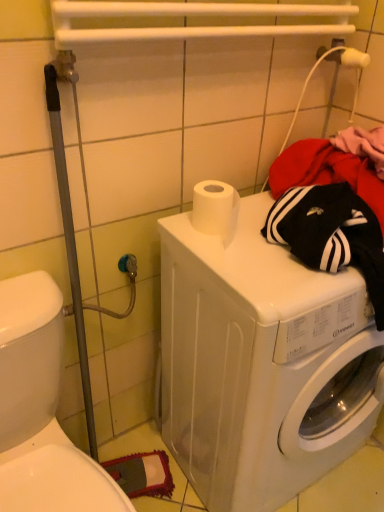
Question: Is white plastic washer at lower right far away from white glossy washing machine at center?

Choices:
 (A) yes
 (B) no

Answer: (B)

Question: Is the position of white plastic washer at lower right less distant than that of white glossy washing machine at center?

Choices:
 (A) no
 (B) yes

Answer: (B)

Question: Does white plastic washer at lower right have a lesser width compared to white glossy washing machine at center?

Choices:
 (A) yes
 (B) no

Answer: (B)

Question: Is white plastic washer at lower right positioned with its back to white glossy washing machine at center?

Choices:
 (A) no
 (B) yes

Answer: (A)

Question: Is white plastic washer at lower right at the right side of white glossy washing machine at center?

Choices:
 (A) no
 (B) yes

Answer: (A)

Question: From the image's perspective, does white plastic washer at lower right appear lower than white glossy washing machine at center?

Choices:
 (A) no
 (B) yes

Answer: (B)

Question: From a real-world perspective, is white glossy washing machine at center on white plastic washer at lower right?

Choices:
 (A) no
 (B) yes

Answer: (B)

Question: Is white glossy washing machine at center closer to camera compared to white plastic washer at lower right?

Choices:
 (A) yes
 (B) no

Answer: (B)

Question: Considering the relative sizes of white glossy washing machine at center and white plastic washer at lower right in the image provided, is white glossy washing machine at center bigger than white plastic washer at lower right?

Choices:
 (A) yes
 (B) no

Answer: (A)

Question: Is white glossy washing machine at center shorter than white plastic washer at lower right?

Choices:
 (A) no
 (B) yes

Answer: (A)

Question: Are white glossy washing machine at center and white plastic washer at lower right making contact?

Choices:
 (A) yes
 (B) no

Answer: (B)

Question: Would you consider white glossy washing machine at center to be distant from white plastic washer at lower right?

Choices:
 (A) yes
 (B) no

Answer: (B)

Question: From the image's perspective, is white plastic washer at lower right positioned above or below white glossy washing machine at center?

Choices:
 (A) below
 (B) above

Answer: (A)